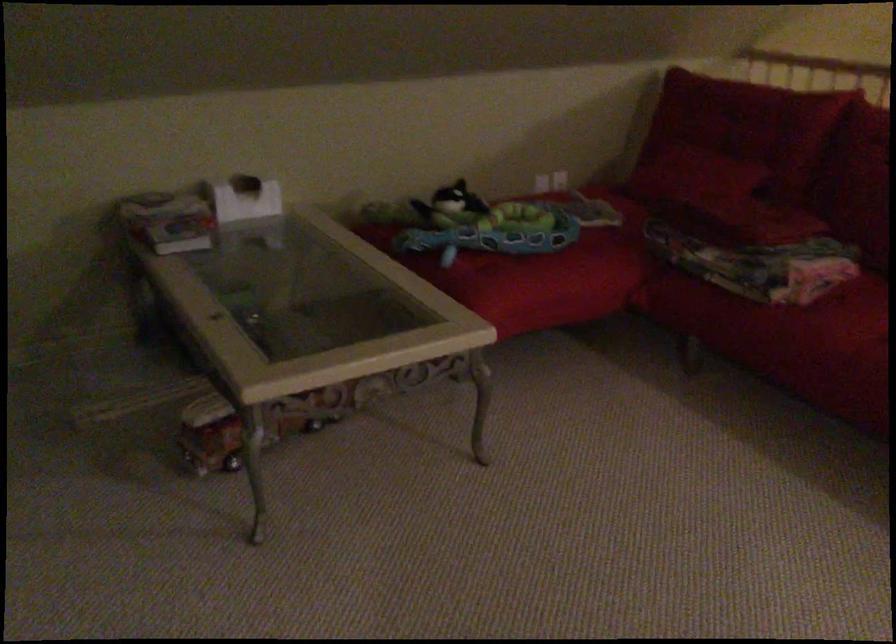
Which object does [495,232] point to?

It corresponds to the blue toy tray in the image.